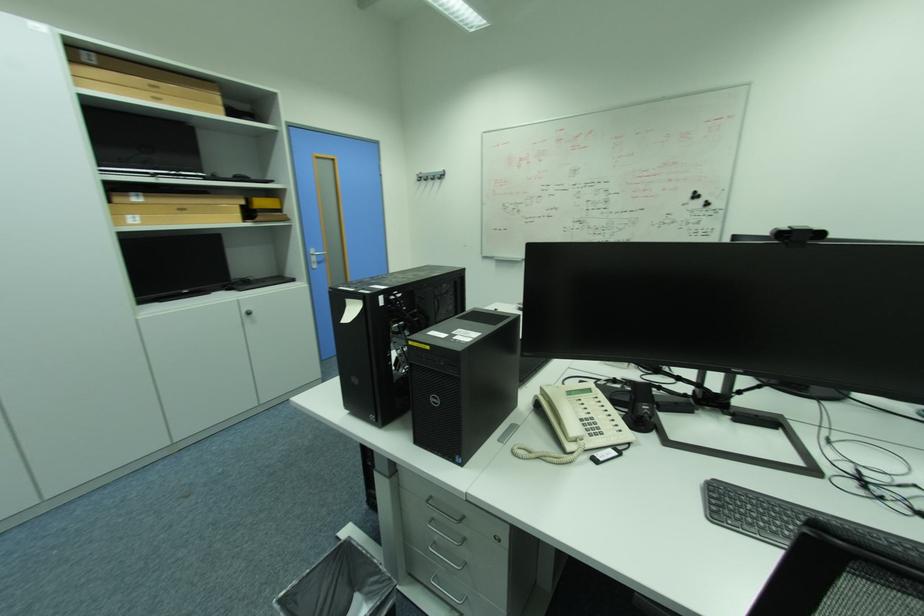
Find where to pull the silver door handle. Please return your answer as a coordinate pair (x, y).

(315, 256)